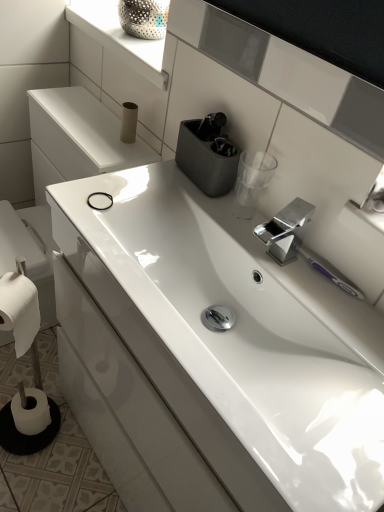
Question: From the image's perspective, is white glossy sink at center below polished metallic tap at center?

Choices:
 (A) yes
 (B) no

Answer: (A)

Question: Is polished metallic tap at center surrounded by white glossy sink at center?

Choices:
 (A) yes
 (B) no

Answer: (B)

Question: Does white glossy sink at center have a larger size compared to polished metallic tap at center?

Choices:
 (A) yes
 (B) no

Answer: (A)

Question: From a real-world perspective, is white glossy sink at center over polished metallic tap at center?

Choices:
 (A) no
 (B) yes

Answer: (A)

Question: Considering the relative positions of white glossy sink at center and polished metallic tap at center in the image provided, is white glossy sink at center to the right of polished metallic tap at center from the viewer's perspective?

Choices:
 (A) no
 (B) yes

Answer: (A)

Question: Based on their sizes in the image, would you say matte cardboard toilet paper at upper center, the 3th toilet paper viewed from the left, is bigger or smaller than white glossy sink at center?

Choices:
 (A) big
 (B) small

Answer: (B)

Question: Looking at their shapes, would you say matte cardboard toilet paper at upper center, the first toilet paper viewed from the right, is wider or thinner than white glossy sink at center?

Choices:
 (A) wide
 (B) thin

Answer: (B)

Question: Considering the positions of point (122, 140) and point (345, 433), is point (122, 140) closer or farther from the camera than point (345, 433)?

Choices:
 (A) closer
 (B) farther

Answer: (B)

Question: From a real-world perspective, is matte cardboard toilet paper at upper center, the first toilet paper viewed from the right, positioned above or below white glossy sink at center?

Choices:
 (A) below
 (B) above

Answer: (B)

Question: From a real-world perspective, is polished metallic tap at center above or below matte gray container at upper center?

Choices:
 (A) below
 (B) above

Answer: (A)

Question: Is polished metallic tap at center in front of or behind matte gray container at upper center in the image?

Choices:
 (A) front
 (B) behind

Answer: (A)

Question: From their relative heights in the image, would you say polished metallic tap at center is taller or shorter than matte gray container at upper center?

Choices:
 (A) short
 (B) tall

Answer: (B)

Question: Considering the positions of polished metallic tap at center and matte gray container at upper center in the image, is polished metallic tap at center wider or thinner than matte gray container at upper center?

Choices:
 (A) thin
 (B) wide

Answer: (B)

Question: Do you think white matte toilet paper at lower left, placed as the third toilet paper when sorted from right to left, is within white glossy sink at center, or outside of it?

Choices:
 (A) outside
 (B) inside

Answer: (A)

Question: In the image, is white matte toilet paper at lower left, the 1th toilet paper when ordered from left to right, positioned in front of or behind white glossy sink at center?

Choices:
 (A) front
 (B) behind

Answer: (B)